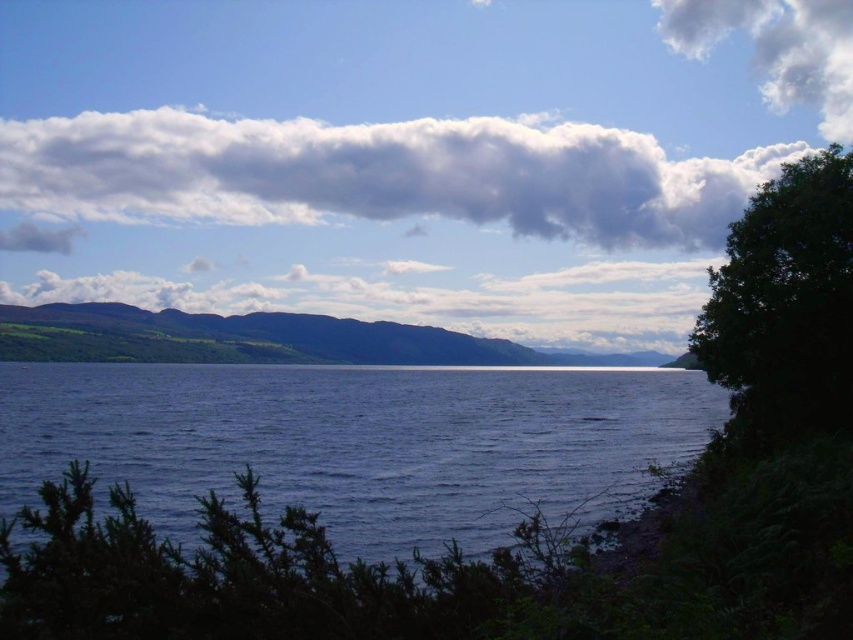
Question: Is green leafy tree at right below white fluffy cloud at upper right?

Choices:
 (A) yes
 (B) no

Answer: (A)

Question: Which of these objects is positioned farthest from the green leafy tree at right?

Choices:
 (A) dark blue water at center
 (B) cloudy sky at upper center

Answer: (B)

Question: Is cloudy sky at upper center to the right of white fluffy cloud at upper right from the viewer's perspective?

Choices:
 (A) yes
 (B) no

Answer: (B)

Question: Is cloudy sky at upper center wider than green leafy tree at right?

Choices:
 (A) yes
 (B) no

Answer: (A)

Question: Considering the real-world distances, which object is closest to the cloudy sky at upper center?

Choices:
 (A) green leafy tree at right
 (B) dark blue water at center

Answer: (B)

Question: Which point is farther to the camera?

Choices:
 (A) (753, 362)
 (B) (213, 433)
 (C) (799, 56)
 (D) (426, 122)

Answer: (C)